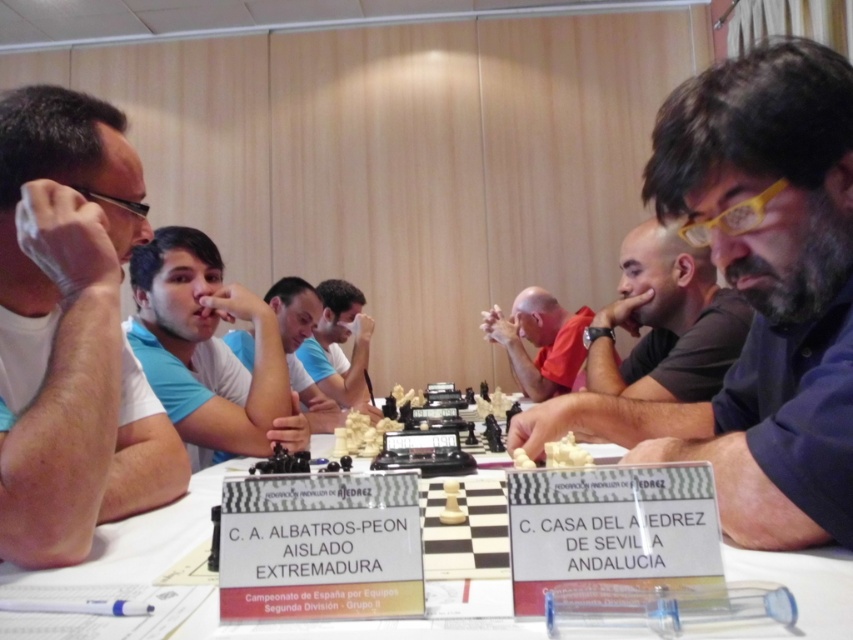
Question: Among these objects, which one is nearest to the camera?

Choices:
 (A) white matte shirt at left
 (B) blue matte shirt at center
 (C) dark gray shirt at center
 (D) matte blue shirt at center

Answer: (A)

Question: Can you confirm if white matte shirt at left is positioned above matte blue shirt at center?

Choices:
 (A) yes
 (B) no

Answer: (A)

Question: Which point is farther to the camera?

Choices:
 (A) matte blue shirt at center
 (B) white matte shirt at left
 (C) matte black chess piece at center
 (D) red matte shirt at center

Answer: (D)

Question: Which point is farther to the camera?

Choices:
 (A) (236, 355)
 (B) (633, 385)
 (C) (53, 476)
 (D) (279, 433)

Answer: (A)

Question: From the image, what is the correct spatial relationship of red matte shirt at center in relation to blue matte shirt at center?

Choices:
 (A) right
 (B) left

Answer: (A)

Question: Does white plastic chessboard at center have a lesser width compared to dark gray shirt at center?

Choices:
 (A) yes
 (B) no

Answer: (B)